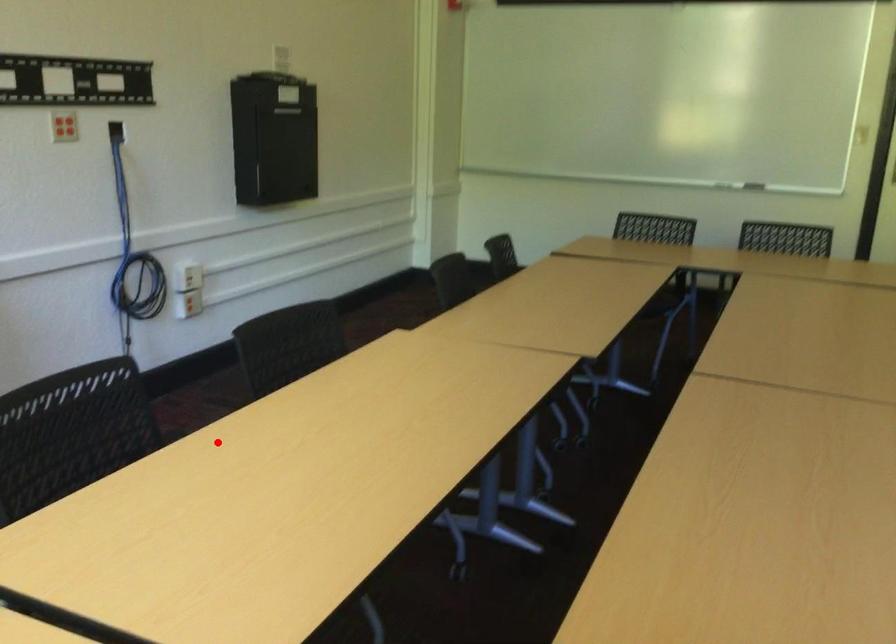
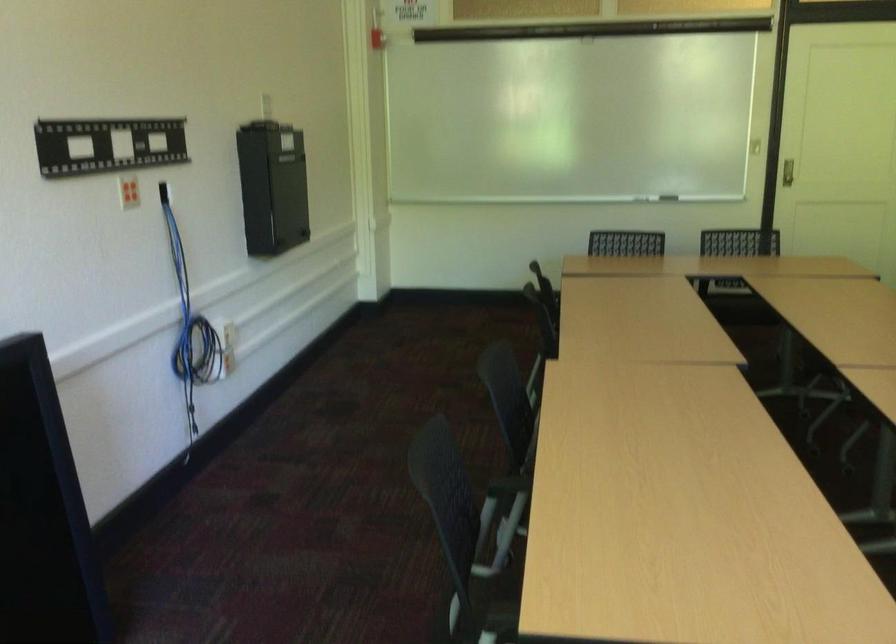
Locate, in the second image, the point that corresponds to the highlighted location in the first image.

(506, 486)